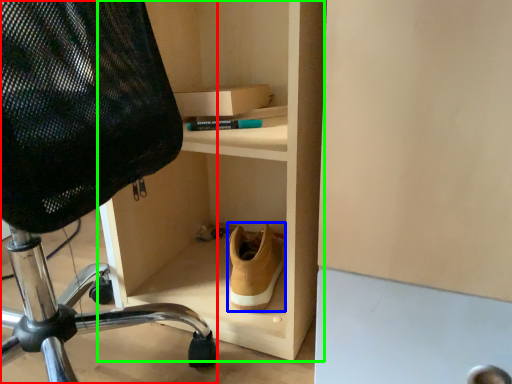
Question: Which is nearer to the chair (highlighted by a red box)? shoe (highlighted by a blue box) or shelf (highlighted by a green box).

Choices:
 (A) shoe
 (B) shelf

Answer: (A)